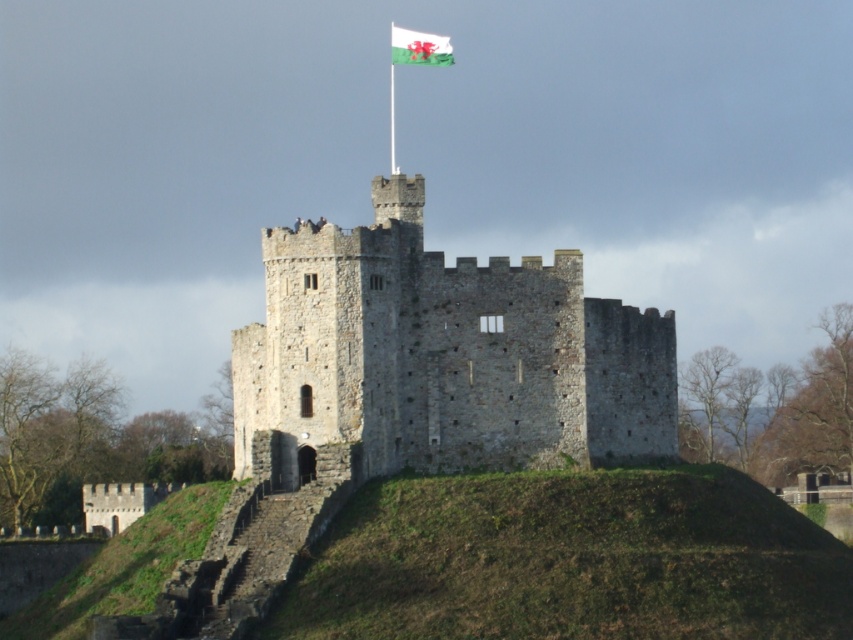
Does stone castle at center lie behind white fabric flag at top?

No, stone castle at center is in front of white fabric flag at top.

What do you see at coordinates (444, 355) in the screenshot?
I see `stone castle at center` at bounding box center [444, 355].

The image size is (853, 640). What are the coordinates of `stone castle at center` in the screenshot? It's located at (444, 355).

Looking at this image, does white fabric flag at top lie behind green metallic pole at upper center?

No.

Can you confirm if white fabric flag at top is positioned above green metallic pole at upper center?

Yes.

Which is in front, point (424, 49) or point (393, 168)?

Positioned in front is point (424, 49).

Identify the location of white fabric flag at top. (419, 48).

Does stone castle at center have a greater height compared to green metallic pole at upper center?

Indeed, stone castle at center has a greater height compared to green metallic pole at upper center.

From the picture: Is stone castle at center below green metallic pole at upper center?

Yes.

Does point (244, 358) come closer to viewer compared to point (390, 157)?

That is True.

Find the location of `stone castle at center`. stone castle at center is located at coordinates (444, 355).